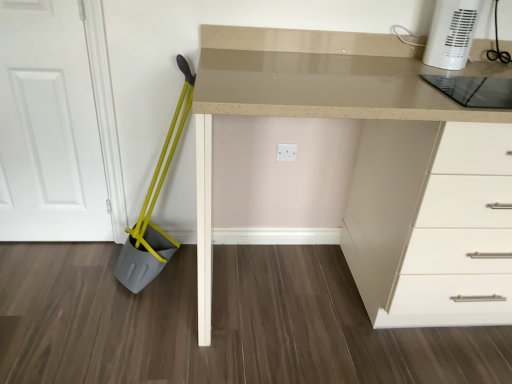
Find the location of `vacant space in matte beige desk at center (from a real-world perspective)`. vacant space in matte beige desk at center (from a real-world perspective) is located at coordinates coord(324,293).